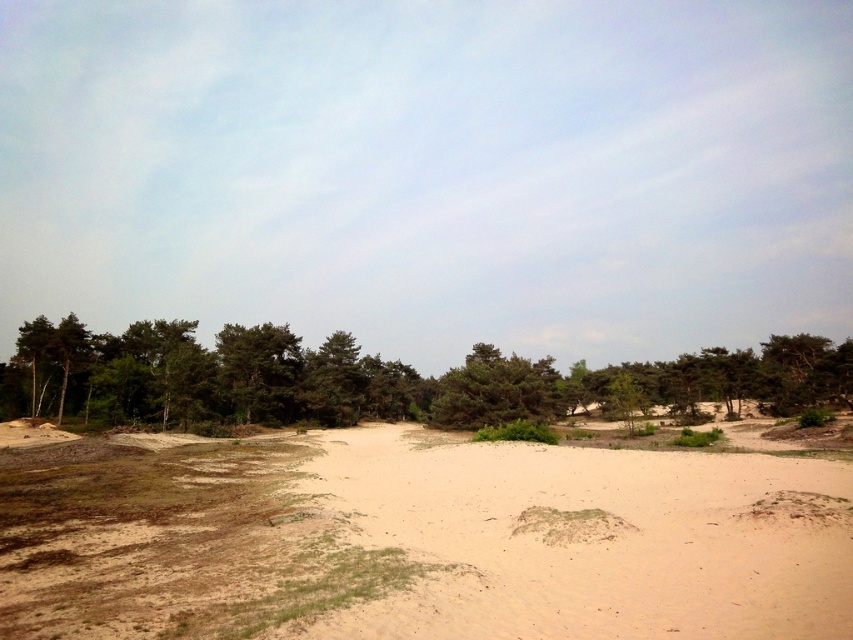
Does light brown sandy ground at center have a larger size compared to green leafy trees at left?

No.

Image resolution: width=853 pixels, height=640 pixels. What do you see at coordinates (419, 540) in the screenshot?
I see `light brown sandy ground at center` at bounding box center [419, 540].

Image resolution: width=853 pixels, height=640 pixels. What do you see at coordinates (419, 540) in the screenshot?
I see `light brown sandy ground at center` at bounding box center [419, 540].

Where is `light brown sandy ground at center`? light brown sandy ground at center is located at coordinates (419, 540).